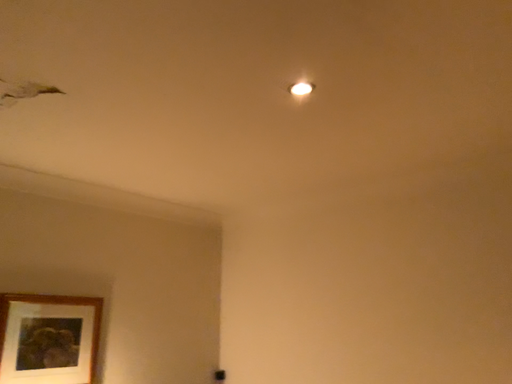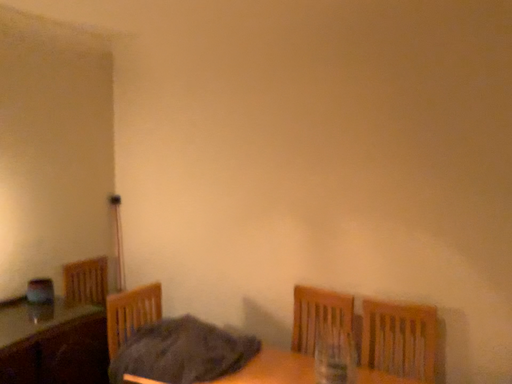
Question: How did the camera likely rotate when shooting the video?

Choices:
 (A) rotated left
 (B) rotated right

Answer: (B)